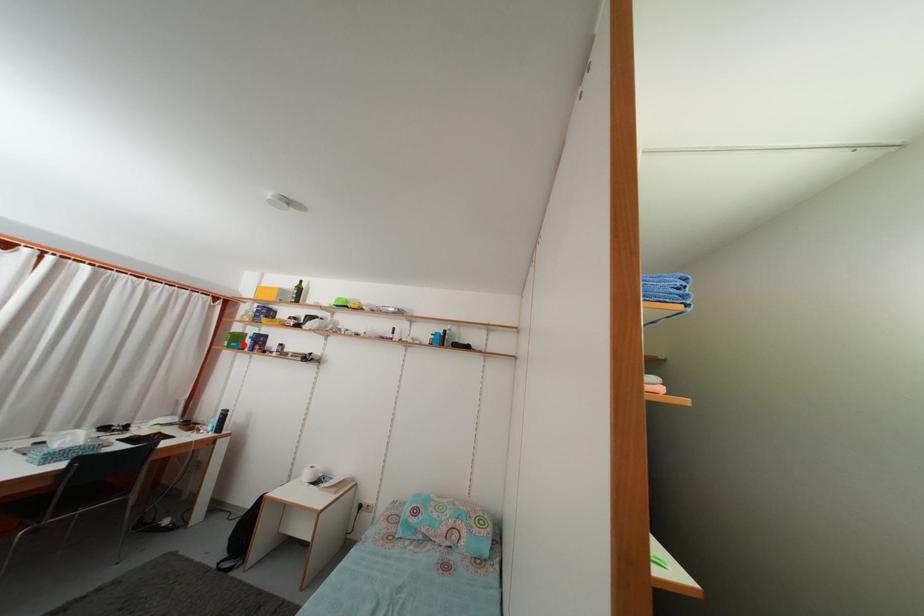
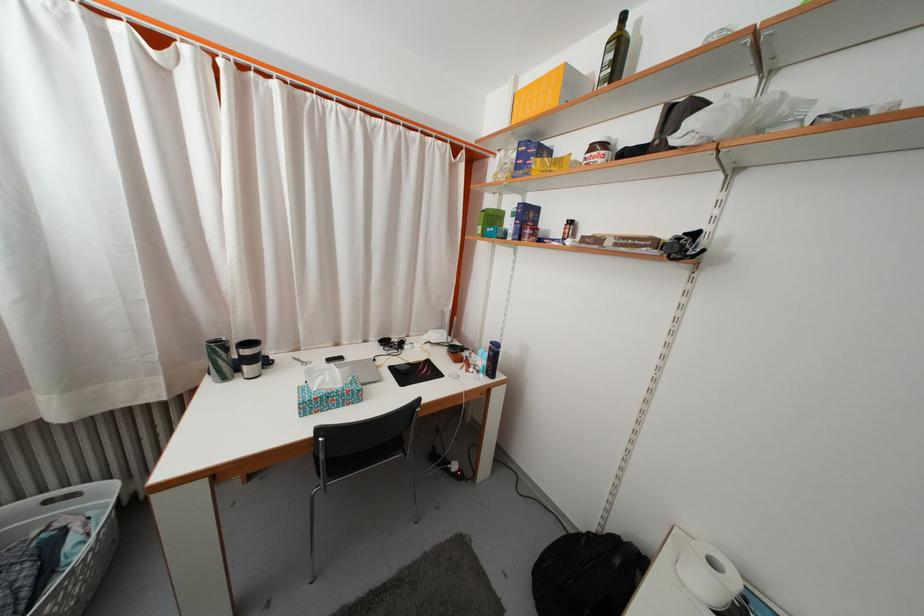
The point at the highlighted location is marked in the first image. Where is the corresponding point in the second image?

(500, 225)